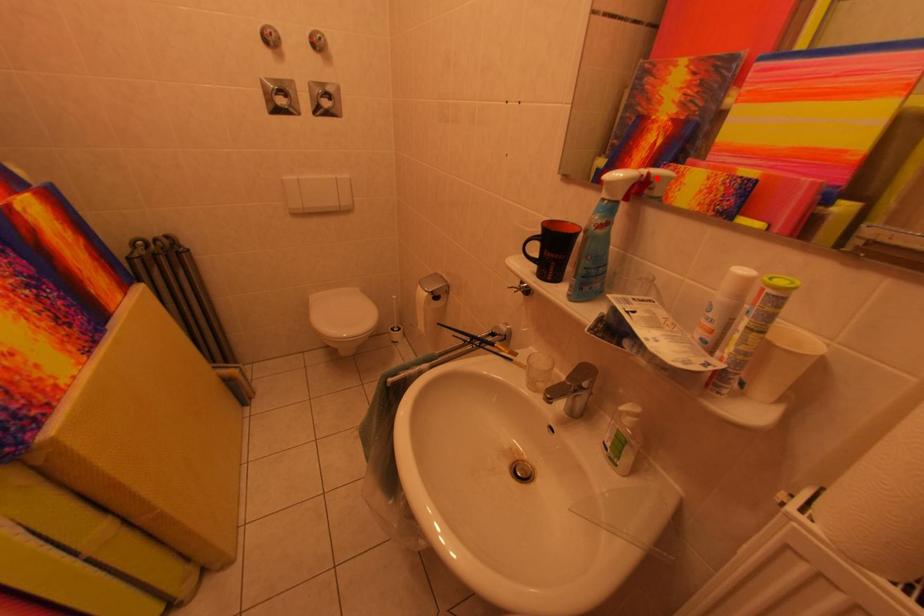
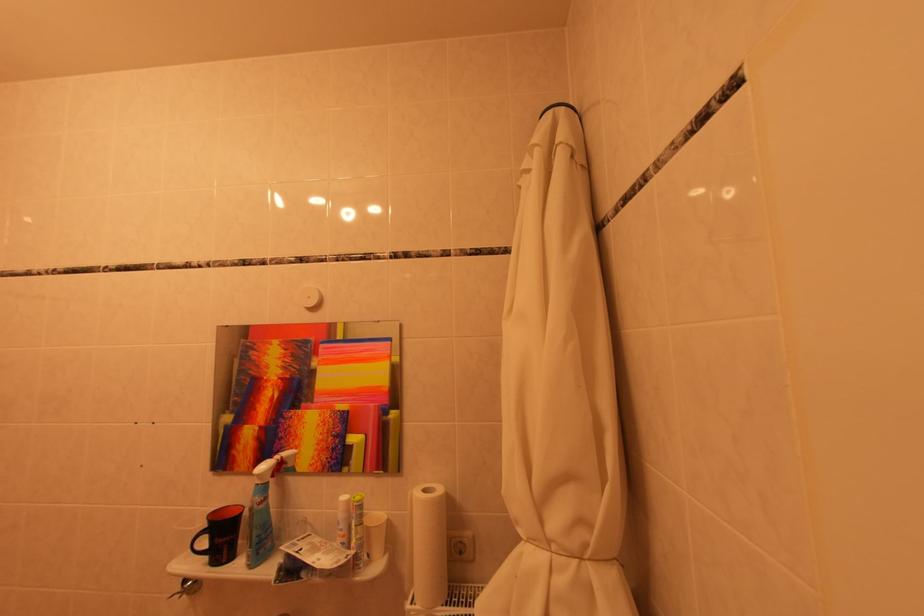
Question: I am providing you with two images of the same scene from different viewpoints. Image1 has a red point marked. In image2, the corresponding 3D location appears at what relative position? Reply with the corresponding letter.

Choices:
 (A) Closer
 (B) Farther

Answer: (A)